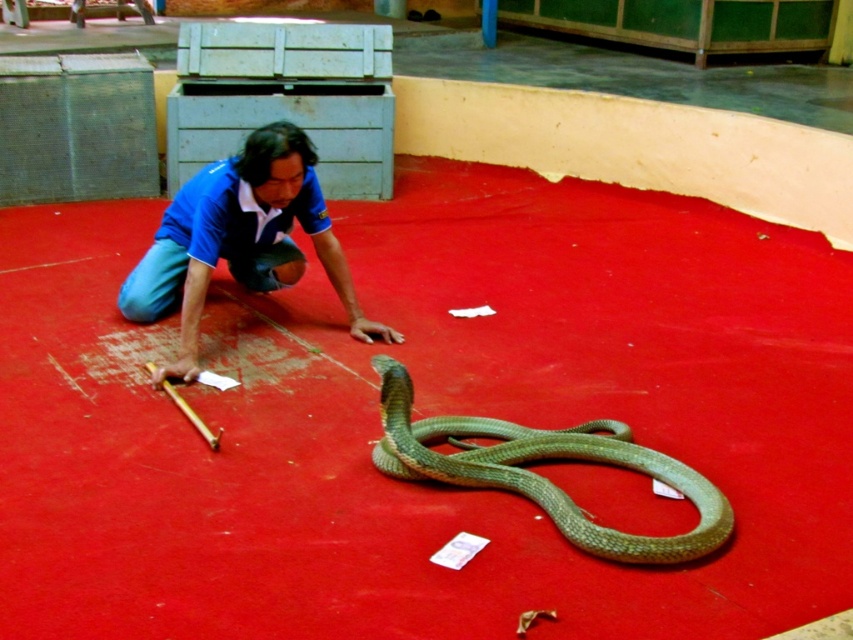
You are a stagehand preparing for a performance. You need to place a 10 feet long snake on the stage. The snake must be placed between the man and the point at point [302,204]. Can the snake fit between them?

The distance between the man and the point at point [302,204] is 11.46 feet. Since the snake is 10 feet long, it can fit between them as the available space is longer than the snake.

You are a costume designer observing the scene and need to ensure the blue cotton shirt at center and the green scaly snake at center are visible to the audience. Based on their sizes, which one is more likely to be obscured if they move closer to the back of the stage?

The blue cotton shirt at center is wider than the green scaly snake at center, so the snake might be more likely to be obscured if they move closer to the back of the stage because it is narrower.

You are a photographer positioned at the back of the room. You want to take a photo of both the blue cotton shirt at center and the green scaly snake at center without any obstruction. Which object should you focus on first to ensure both are in frame?

The blue cotton shirt at center is much taller than the green scaly snake at center, so you should focus on the blue cotton shirt at center first to ensure both are in frame.